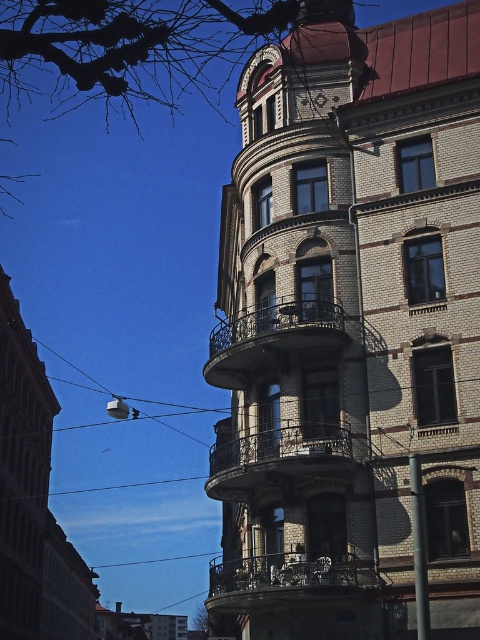
You are standing in front of a multi story building with curved balconies. You see a point at coordinates (278, 460). What architectural feature is located at that point?

The point at coordinates (278, 460) indicates a dark brown wrought iron balcony at center.

You are an architect analyzing the building facade. You need to determine which object, the dark brown wrought iron balcony at center or the white ceramic clock at upper center, has a greater horizontal span. Based on the architectural details provided, which one is wider?

The dark brown wrought iron balcony at center has a greater horizontal span than the white ceramic clock at upper center because its width is larger.

You are an architect assessing the building facade. You need to determine if the metallic wrought iron balcony at center can support a new decorative sculpture that requires a minimum width of 1.2 meters. Given that the white ceramic clock at upper center is 0.8 meters wide, can you estimate if the balcony is wide enough?

The metallic wrought iron balcony at center might be wider than the white ceramic clock at upper center, which is 0.8 meters wide. Therefore, the balcony could potentially be wider than 1.2 meters, meeting the sculpture requirement. However, an exact measurement is needed for confirmation.